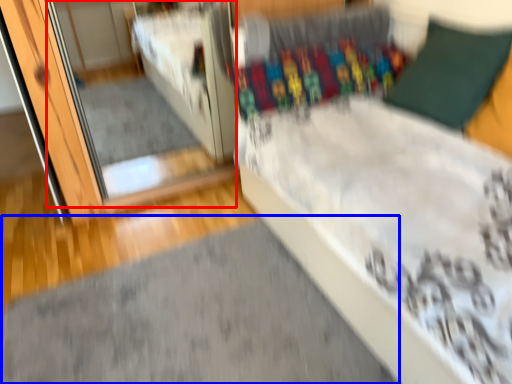
Question: Which object appears closest to the camera in this image, mirror (highlighted by a red box) or doormat (highlighted by a blue box)?

Choices:
 (A) mirror
 (B) doormat

Answer: (B)